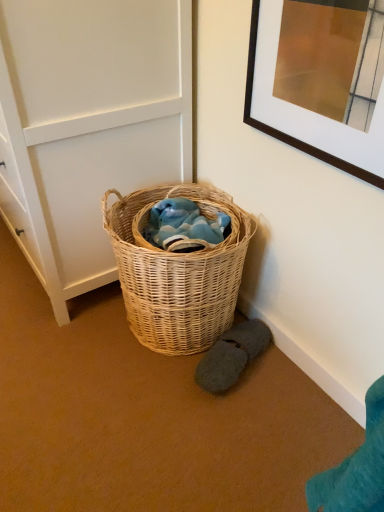
This screenshot has width=384, height=512. Identify the location of dark gray fuzzy slippers at lower right. (231, 356).

This screenshot has height=512, width=384. Find the location of `white paneling at center`. white paneling at center is located at coordinates (88, 125).

Locate an element on the screen. woven natural basket at center is located at coordinates (177, 271).

Considering the sizes of objects white paneling at center and dark gray fuzzy slippers at lower right in the image provided, who is bigger, white paneling at center or dark gray fuzzy slippers at lower right?

white paneling at center is bigger.

How much distance is there between white paneling at center and dark gray fuzzy slippers at lower right?

white paneling at center and dark gray fuzzy slippers at lower right are 27.89 inches apart.

From a real-world perspective, between white paneling at center and dark gray fuzzy slippers at lower right, who is vertically lower?

dark gray fuzzy slippers at lower right, from a real-world perspective.

Between white paneling at center and dark gray fuzzy slippers at lower right, which one has smaller width?

With smaller width is dark gray fuzzy slippers at lower right.

Does white paneling at center lie behind woven natural basket at center?

No, it is not.

Between white paneling at center and woven natural basket at center, which one has larger size?

white paneling at center is bigger.

From the image's perspective, would you say white paneling at center is shown under woven natural basket at center?

Incorrect, from the image's perspective, white paneling at center is higher than woven natural basket at center.

Which is more to the left, white paneling at center or woven natural basket at center?

Positioned to the left is white paneling at center.

Is dark gray fuzzy slippers at lower right oriented away from woven natural basket at center?

Yes.

Looking at this image, does dark gray fuzzy slippers at lower right appear on the left side of woven natural basket at center?

In fact, dark gray fuzzy slippers at lower right is to the right of woven natural basket at center.

At what (x,y) coordinates should I click in order to perform the action: click on picnic basket on the left of dark gray fuzzy slippers at lower right. Please return your answer as a coordinate pair (x, y). The height and width of the screenshot is (512, 384). Looking at the image, I should click on (177, 271).

In the image, is woven natural basket at center positioned in front of or behind dark gray fuzzy slippers at lower right?

Clearly, woven natural basket at center is in front of dark gray fuzzy slippers at lower right.

Is woven natural basket at center oriented away from dark gray fuzzy slippers at lower right?

No.

Considering the points (197, 345) and (226, 334), which point is in front, point (197, 345) or point (226, 334)?

The point (197, 345) is closer to the camera.

Who is taller, woven natural basket at center or dark gray fuzzy slippers at lower right?

woven natural basket at center.

Considering the sizes of woven natural basket at center and white paneling at center in the image, is woven natural basket at center wider or thinner than white paneling at center?

woven natural basket at center is thinner than white paneling at center.

From the image's perspective, is woven natural basket at center above or below white paneling at center?

woven natural basket at center is situated lower than white paneling at center in the image.

Measure the distance from woven natural basket at center to white paneling at center.

11.03 inches.

Looking at this image, is dark gray fuzzy slippers at lower right looking in the opposite direction of white paneling at center?

No.

Between dark gray fuzzy slippers at lower right and white paneling at center, which one has larger size?

white paneling at center.

Looking at this image, from the image's perspective, is dark gray fuzzy slippers at lower right above white paneling at center?

Actually, dark gray fuzzy slippers at lower right appears below white paneling at center in the image.

Where is `door that is above the dark gray fuzzy slippers at lower right (from the image's perspective)`? The height and width of the screenshot is (512, 384). door that is above the dark gray fuzzy slippers at lower right (from the image's perspective) is located at coordinates (88, 125).

Locate an element on the screen. The height and width of the screenshot is (512, 384). picnic basket on the right of white paneling at center is located at coordinates (177, 271).

Looking at the image, which one is located further to woven natural basket at center, white paneling at center or dark gray fuzzy slippers at lower right?

white paneling at center lies further to woven natural basket at center than the other object.

Based on their spatial positions, is dark gray fuzzy slippers at lower right or woven natural basket at center further from white paneling at center?

The object further to white paneling at center is dark gray fuzzy slippers at lower right.

In the scene shown: Which object lies nearer to the anchor point dark gray fuzzy slippers at lower right, white paneling at center or woven natural basket at center?

Among the two, woven natural basket at center is located nearer to dark gray fuzzy slippers at lower right.

When comparing their distances from white paneling at center, does woven natural basket at center or dark gray fuzzy slippers at lower right seem closer?

woven natural basket at center is positioned closer to the anchor white paneling at center.

Considering their positions, is woven natural basket at center positioned further to dark gray fuzzy slippers at lower right than white paneling at center?

white paneling at center is positioned further to the anchor dark gray fuzzy slippers at lower right.

From the image, which object appears to be nearer to woven natural basket at center, dark gray fuzzy slippers at lower right or white paneling at center?

dark gray fuzzy slippers at lower right lies closer to woven natural basket at center than the other object.

At what (x,y) coordinates should I click in order to perform the action: click on picnic basket between white paneling at center and dark gray fuzzy slippers at lower right in the vertical direction. Please return your answer as a coordinate pair (x, y). Looking at the image, I should click on (177, 271).